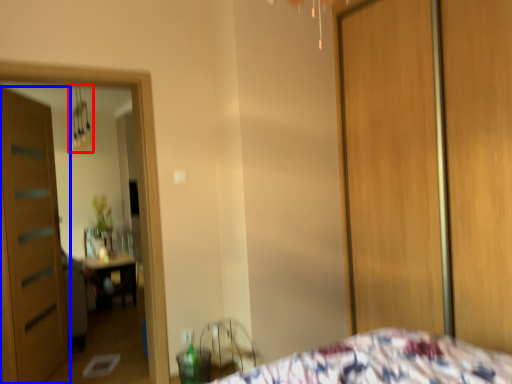
Question: Which object is closer to the camera taking this photo, light fixture (highlighted by a red box) or door (highlighted by a blue box)?

Choices:
 (A) light fixture
 (B) door

Answer: (B)